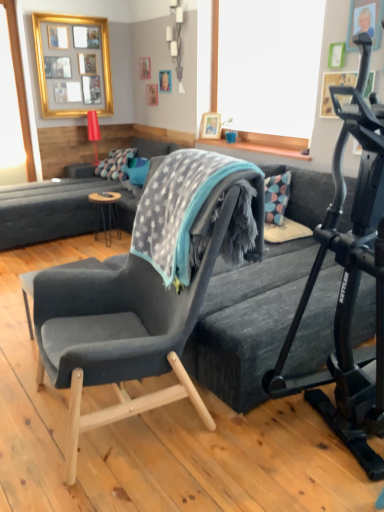
Question: Is black metal treadmill at right wider or thinner than multicolored fabric pillow at center, positioned as the 1th pillow in left-to-right order?

Choices:
 (A) wide
 (B) thin

Answer: (A)

Question: Relative to multicolored fabric pillow at center, positioned as the second pillow in right-to-left order, is black metal treadmill at right in front or behind?

Choices:
 (A) behind
 (B) front

Answer: (B)

Question: Estimate the real-world distances between objects in this image. Which object is closer to the velvet dark gray couch at center?

Choices:
 (A) velvet dark gray armchair at center
 (B) black metal treadmill at right
 (C) teal fabric pillow at center, which is the 1th pillow from right to left
 (D) gray fleece blanket at center
 (E) gold metallic picture frame at upper left

Answer: (C)

Question: Estimate the real-world distances between objects in this image. Which object is closer to the teal fabric pillow at center, acting as the second pillow starting from the left?

Choices:
 (A) multicolored fabric pillow at center, positioned as the 1th pillow in left-to-right order
 (B) gray fleece blanket at center
 (C) black metal treadmill at right
 (D) wooden black table at center
 (E) velvet dark gray couch at center

Answer: (D)